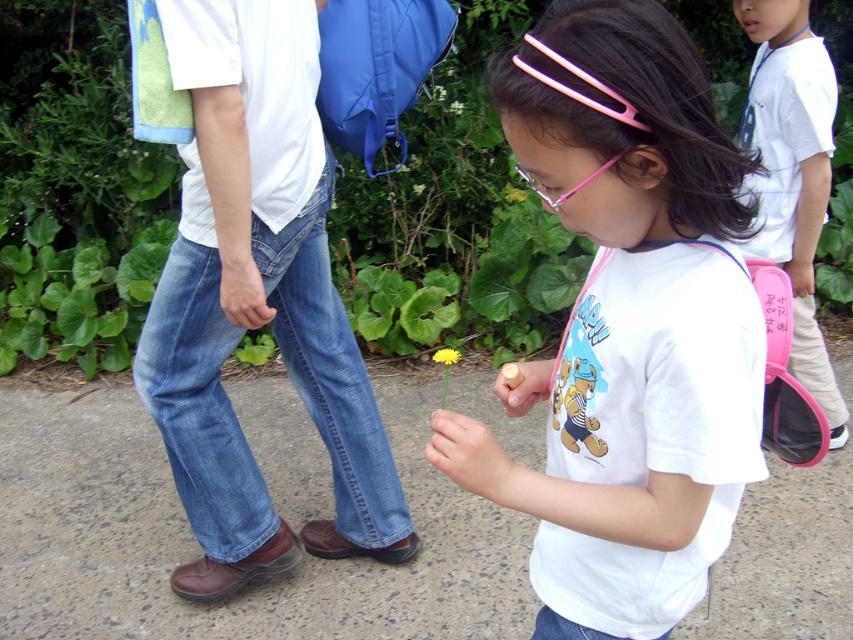
Is white matte t-shirt at center further to camera compared to gray concrete pavement at center?

No, it is not.

What do you see at coordinates (627, 328) in the screenshot? I see `white matte t-shirt at center` at bounding box center [627, 328].

Where is `white matte t-shirt at center`? This screenshot has height=640, width=853. white matte t-shirt at center is located at coordinates (627, 328).

Is point (538, 193) more distant than point (444, 384)?

No, it is not.

Who is higher up, pink plastic goggles at center or yellow matte dandelion at center?

pink plastic goggles at center is above.

Describe the element at coordinates (567, 189) in the screenshot. The image size is (853, 640). I see `pink plastic goggles at center` at that location.

This screenshot has width=853, height=640. In order to click on pink plastic goggles at center in this screenshot , I will do click(567, 189).

Can you confirm if pink plastic hair clip at upper center is taller than yellow matte flower at center?

Correct, pink plastic hair clip at upper center is much taller as yellow matte flower at center.

Between pink plastic hair clip at upper center and yellow matte flower at center, which one is positioned lower?

yellow matte flower at center is below.

This screenshot has height=640, width=853. I want to click on pink plastic hair clip at upper center, so click(577, 92).

Identify the location of pink plastic hair clip at upper center. The height and width of the screenshot is (640, 853). (577, 92).